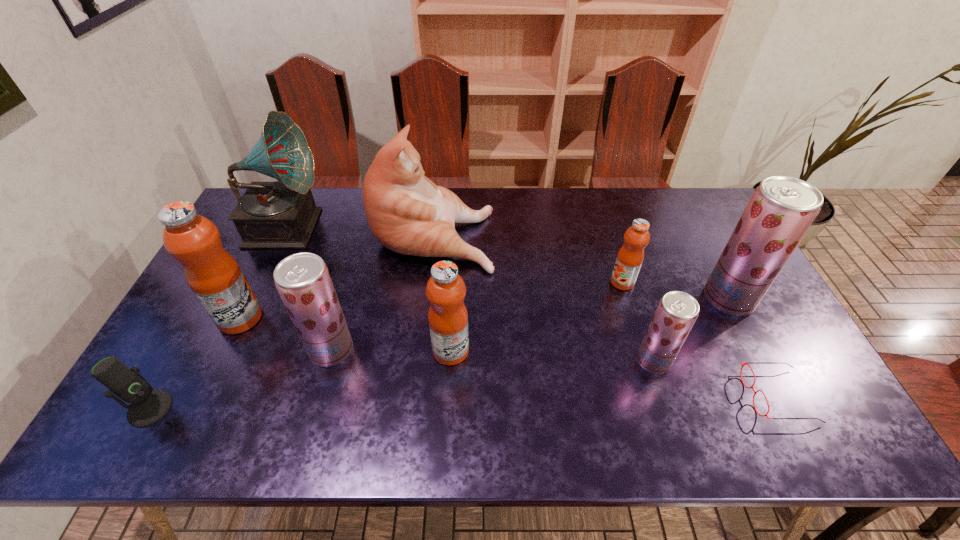
The height and width of the screenshot is (540, 960). Find the location of `record player`. record player is located at coordinates (282, 214).

Locate an element on the screen. Image resolution: width=960 pixels, height=540 pixels. cat is located at coordinates (409, 214).

Find the location of a particular element. the rightmost fruit juice is located at coordinates (781, 210).

Locate an element on the screen. the farthest strawberry fruit juice is located at coordinates (781, 210).

What are the coordinates of `the second nearest orange fruit juice` in the screenshot? It's located at (214, 276).

This screenshot has height=540, width=960. I want to click on the leftmost fruit juice, so click(x=214, y=276).

The height and width of the screenshot is (540, 960). I want to click on the leftmost strawberry fruit juice, so click(303, 281).

Identify the location of the second smallest strawberry fruit juice. (303, 281).

This screenshot has height=540, width=960. Find the location of `the fourth fruit juice from right to left`. the fourth fruit juice from right to left is located at coordinates (448, 318).

Where is `the second smallest orange fruit juice`? the second smallest orange fruit juice is located at coordinates (448, 318).